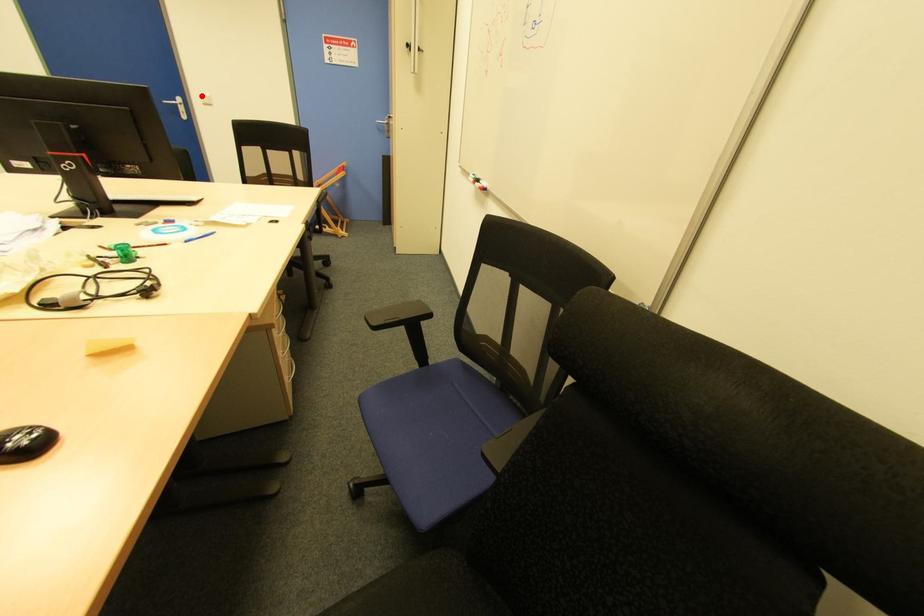
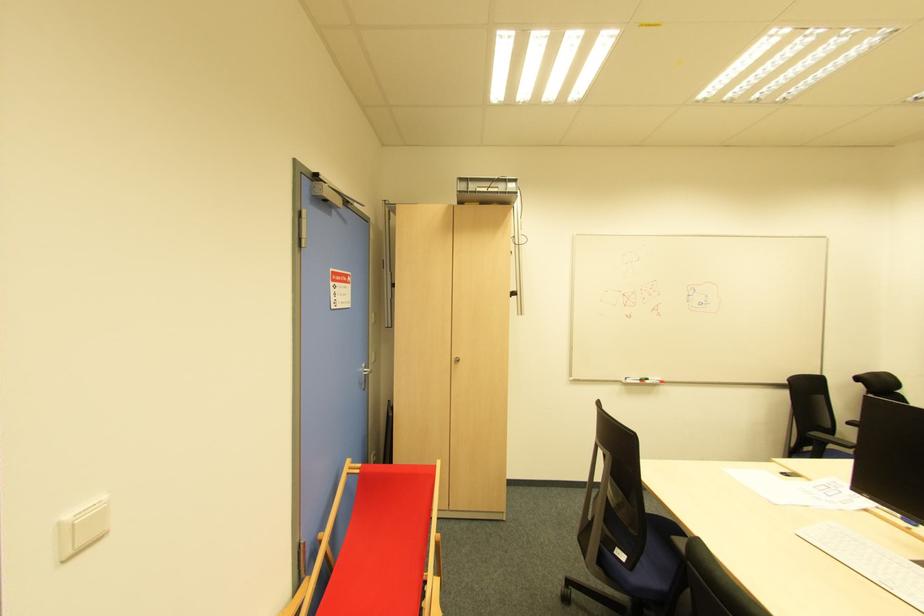
Locate, in the second image, the point that corresponds to the highlighted location in the first image.

(69, 517)